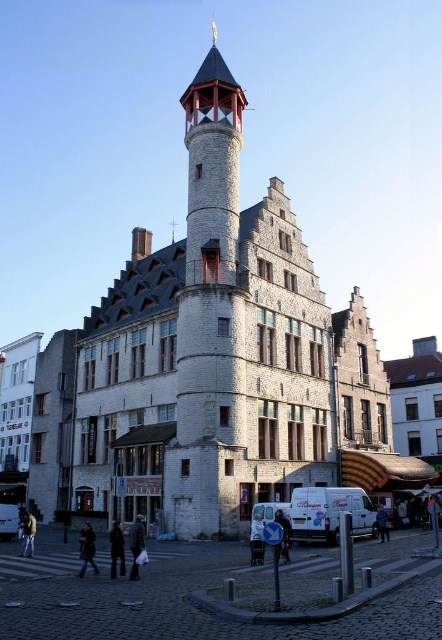
Question: Does light gray stone tower at center lie in front of light brown leather jacket at lower left?

Choices:
 (A) yes
 (B) no

Answer: (B)

Question: Does black leather jacket at lower center appear on the left side of dark brown leather coat at lower center?

Choices:
 (A) no
 (B) yes

Answer: (A)

Question: Which object appears closest to the camera in this image?

Choices:
 (A) dark brown leather coat at lower left
 (B) dark gray jacket at lower center

Answer: (A)

Question: Based on their relative distances, which object is farther from the light brown leather jacket at lower left?

Choices:
 (A) dark gray jacket at lower center
 (B) dark brown leather coat at lower center

Answer: (A)

Question: Can you confirm if light gray stone tower at center is thinner than light brown leather jacket at lower left?

Choices:
 (A) no
 (B) yes

Answer: (A)

Question: Which of the following is the closest to the observer?

Choices:
 (A) (26, 532)
 (B) (113, 560)
 (C) (133, 566)
 (D) (259, 540)

Answer: (C)